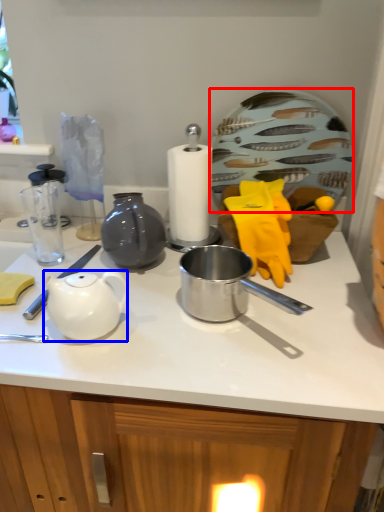
Question: Among these objects, which one is nearest to the camera, plate (highlighted by a red box) or teapot (highlighted by a blue box)?

Choices:
 (A) plate
 (B) teapot

Answer: (B)